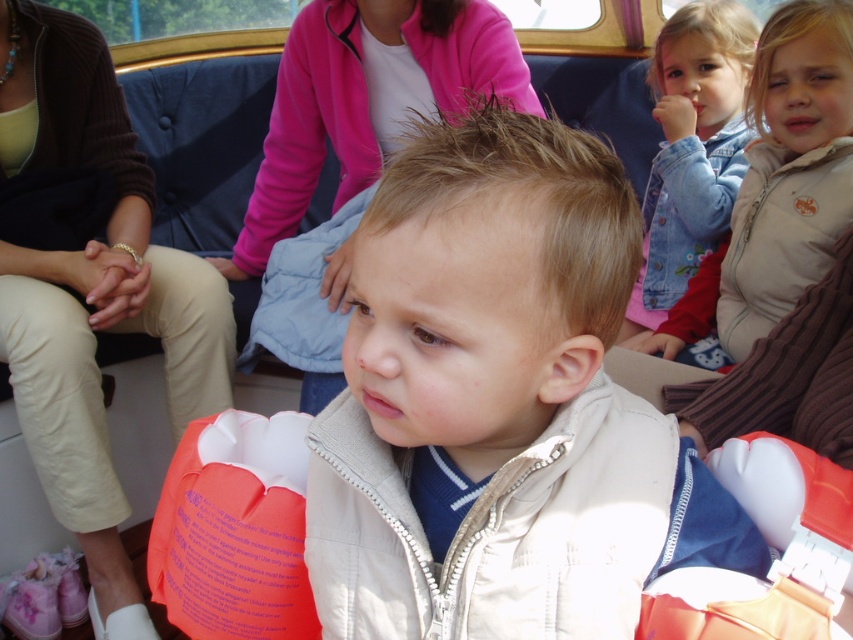
Question: Is orange life vest at lower left positioned before denim jacket at upper right?

Choices:
 (A) yes
 (B) no

Answer: (A)

Question: Is denim jacket at upper right behind beige fleece jacket at upper right?

Choices:
 (A) yes
 (B) no

Answer: (A)

Question: Which of these objects is positioned farthest from the white matte vest at center?

Choices:
 (A) orange life vest at lower left
 (B) denim jacket at upper right
 (C) beige fleece jacket at upper right

Answer: (B)

Question: Does white matte vest at center have a larger size compared to denim jacket at upper right?

Choices:
 (A) yes
 (B) no

Answer: (B)

Question: Which of the following is the closest to the observer?

Choices:
 (A) (480, 432)
 (B) (817, 240)
 (C) (32, 426)

Answer: (A)

Question: Which point is closer to the camera?

Choices:
 (A) orange life vest at lower left
 (B) beige fleece jacket at upper right
 (C) denim jacket at upper right

Answer: (B)